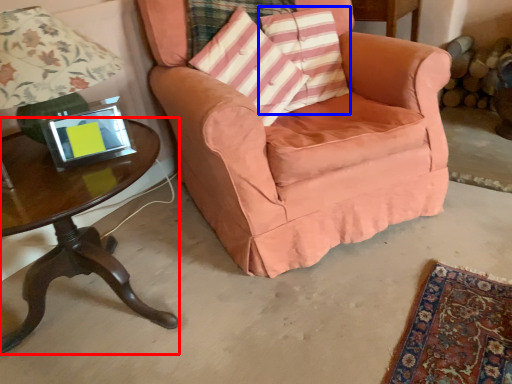
Question: Which point is closer to the camera, table (highlighted by a red box) or pillow (highlighted by a blue box)?

Choices:
 (A) table
 (B) pillow

Answer: (A)